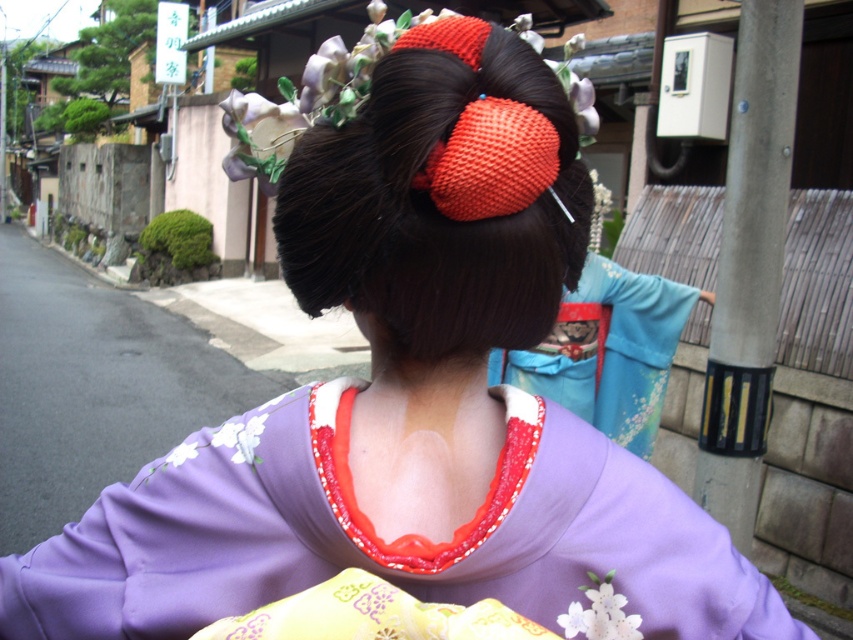
You are a photographer trying to capture the purple satin kimono at center and the smooth dark brown hair bun at center in a single frame. Which object should you focus on first to ensure both are in the frame?

The purple satin kimono at center is shorter than the smooth dark brown hair bun at center, so you should focus on the purple satin kimono at center first to ensure both are in the frame.

In the scene shown: You are a photographer trying to capture both the purple satin kimono at center and the smooth dark brown hair bun at center in a single frame. Based on their sizes, which object will appear larger in the photo?

The purple satin kimono at center will appear larger in the photo since it is bigger than the smooth dark brown hair bun at center.

You are an artist trying to sketch the scene. You need to place the purple satin kimono at center in your drawing. What are the coordinates where you should position it?

The purple satin kimono at center should be placed at coordinates 0.847 on the x axis and 0.460 on the y axis.